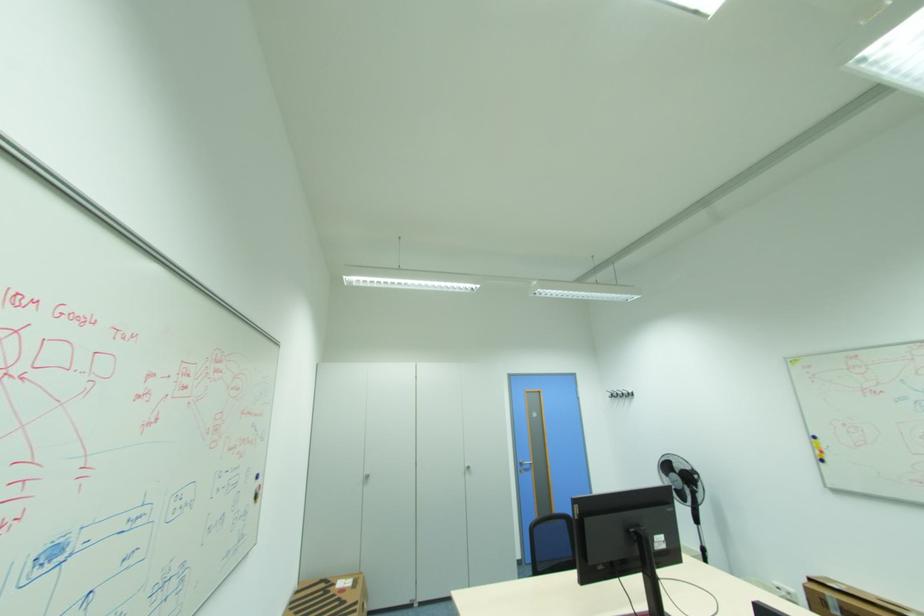
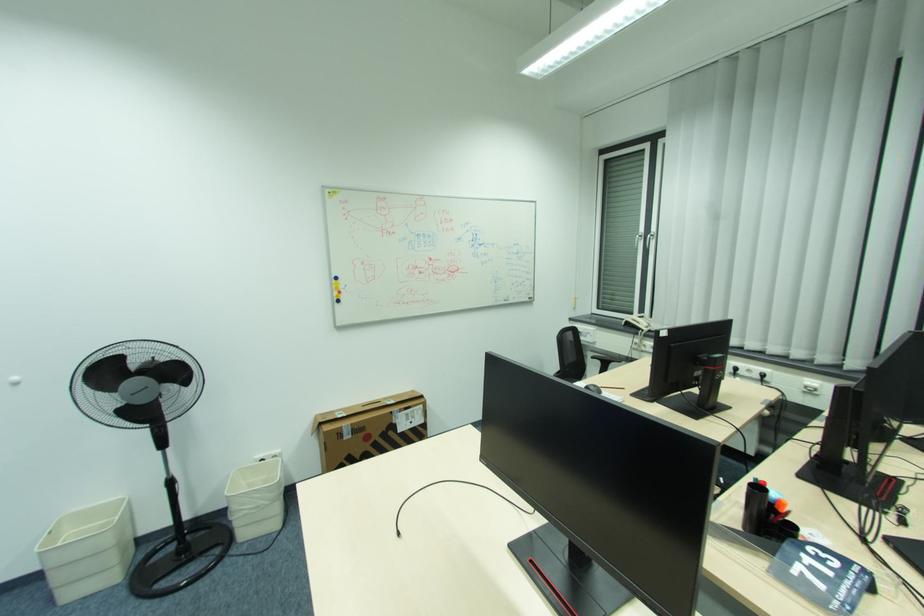
The point at (822, 453) is marked in the first image. Where is the corresponding point in the second image?

(341, 294)